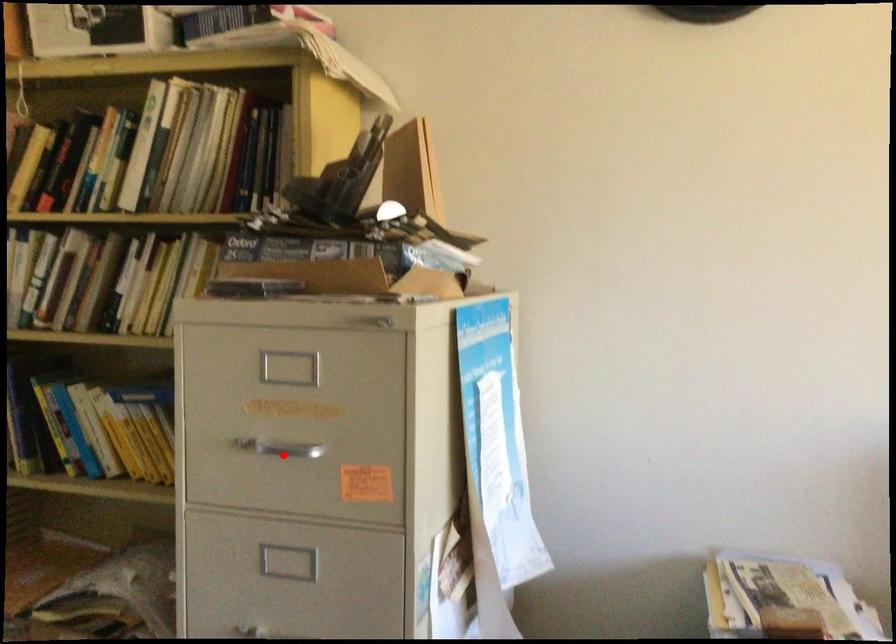
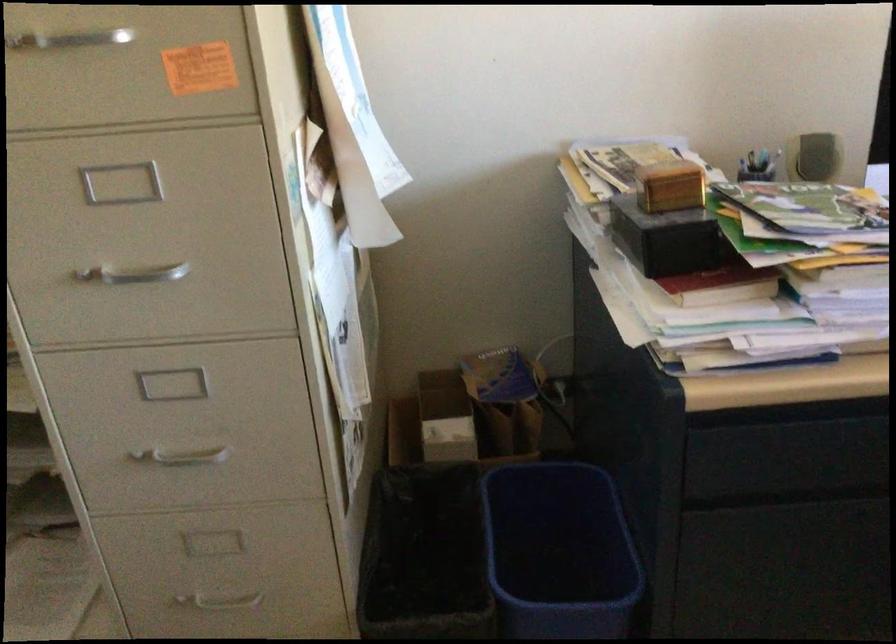
Where in the second image is the point corresponding to the highlighted location from the first image?

(67, 40)